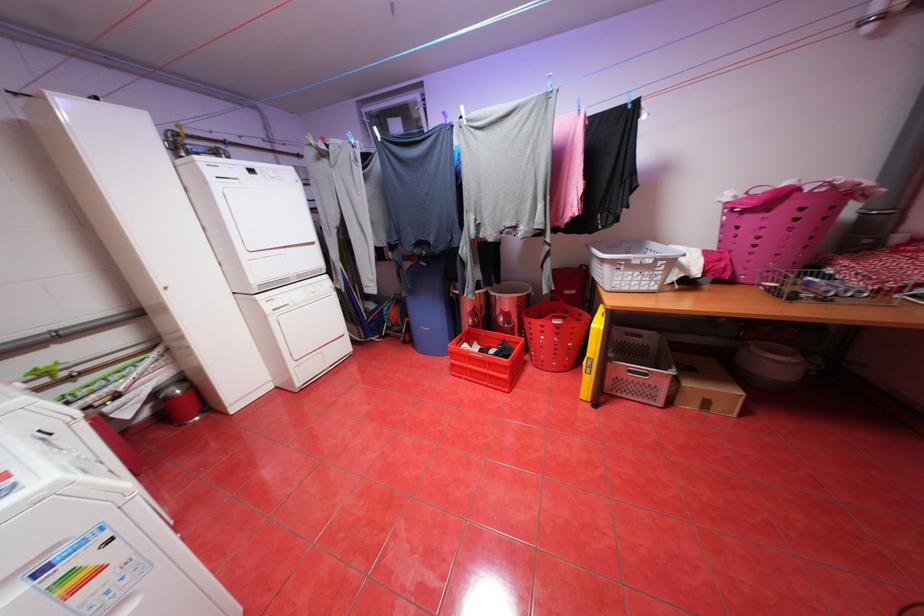
Find where to lift the red basket handle. Please return your answer as a coordinate pair (x, y).

(553, 321)